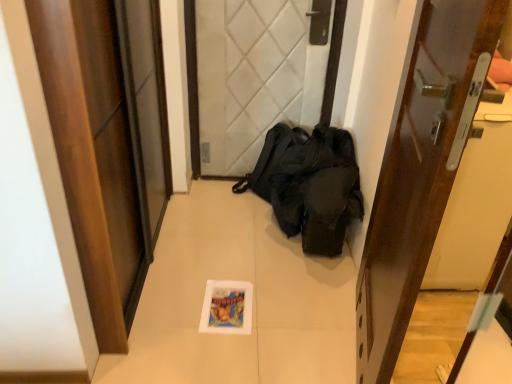
Where is `vacant space underneath wooden door at left, placed as the first door when sorted from left to right (from a real-world perspective)`? vacant space underneath wooden door at left, placed as the first door when sorted from left to right (from a real-world perspective) is located at coordinates [x=142, y=278].